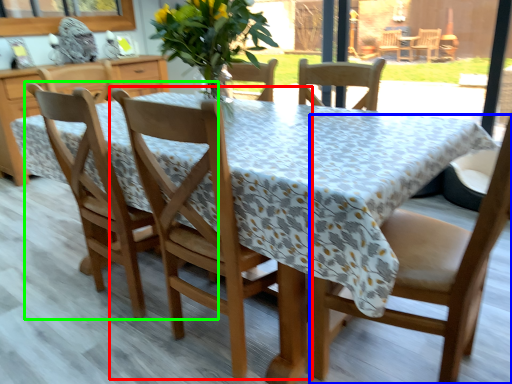
Question: Which object is positioned closest to chair (highlighted by a red box)? Select from chair (highlighted by a blue box) and chair (highlighted by a green box).

Choices:
 (A) chair
 (B) chair

Answer: (B)